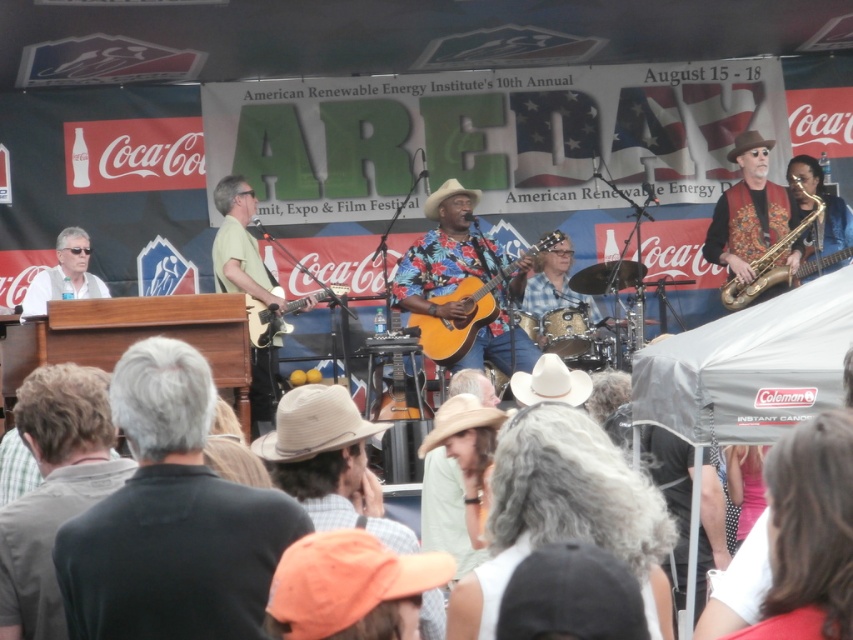
Question: Can you confirm if metallic drum at center is bigger than brown felt cowboy hat at upper right?

Choices:
 (A) yes
 (B) no

Answer: (A)

Question: Can you confirm if matte black guitar at center is smaller than metallic drum at center?

Choices:
 (A) no
 (B) yes

Answer: (A)

Question: Which of these objects is positioned closest to the gray hair at center?

Choices:
 (A) metallic drum at center
 (B) matte black guitar at center
 (C) black matte shirt at center
 (D) white cotton shirt at lower right

Answer: (D)

Question: Which object is farther from the camera taking this photo?

Choices:
 (A) brown felt cowboy hat at center
 (B) white felt cowboy hat at center
 (C) green matte guitar at center

Answer: (C)

Question: Which point is closer to the camera?

Choices:
 (A) (79, 230)
 (B) (428, 310)
 (C) (325, 419)

Answer: (C)

Question: Does black matte shirt at center have a larger size compared to green matte guitar at center?

Choices:
 (A) no
 (B) yes

Answer: (B)